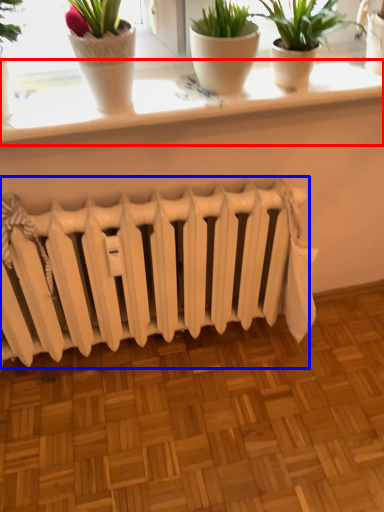
Question: Among these objects, which one is nearest to the camera, window sill (highlighted by a red box) or radiator (highlighted by a blue box)?

Choices:
 (A) window sill
 (B) radiator

Answer: (A)